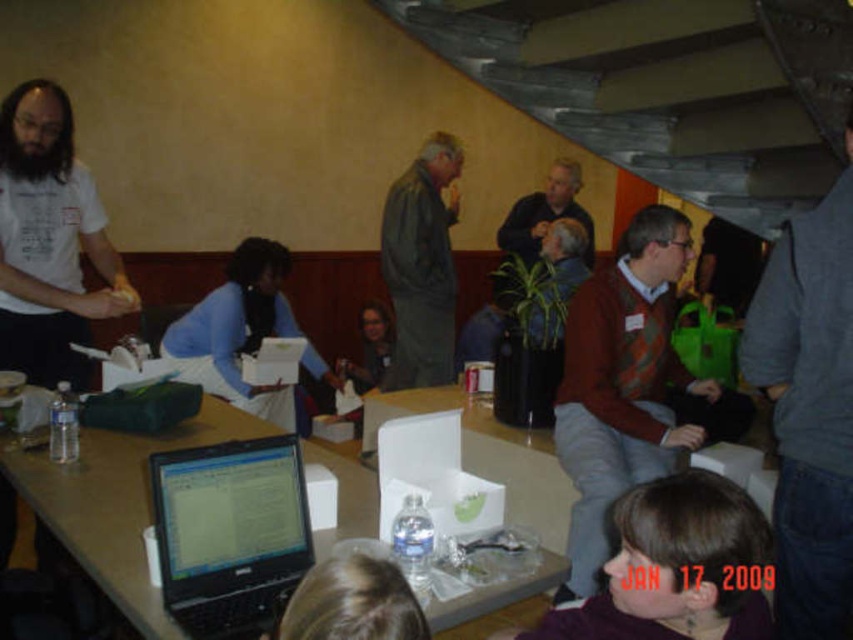
You are organizing a photo shoot and need to place two shirts in the scene for a catalog. The white matte shirt at left and the blue matte shirt at center must be positioned according to their sizes. Which shirt should be placed closer to the camera to maintain the size relationship shown in the image?

The white matte shirt at left, which is smaller in size compared to the blue matte shirt at center, should be placed closer to the camera to maintain the size relationship shown in the image.

You are standing at the entrance of the room and want to locate the person wearing the purple matte shirt at lower center. According to the coordinates provided, where should you look to find them?

The purple matte shirt at lower center is located at coordinates point (677,566), which means you should look towards the lower right area of the room to find them.

You are a participant in the meeting and want to grab a water bottle from the matte plastic table at center. The knitted sweater at center is in your way. Can you reach the table without moving the sweater?

The matte plastic table at center is behind knitted sweater at center, so you cannot reach the table without moving the sweater.